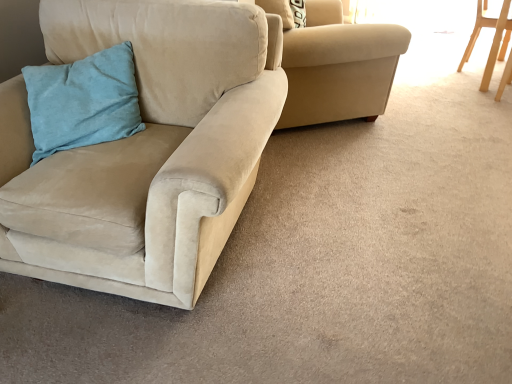
What do you see at coordinates (145, 149) in the screenshot?
I see `suede beige couch at left, which appears as the 3th chair when viewed from the right` at bounding box center [145, 149].

The height and width of the screenshot is (384, 512). Describe the element at coordinates (83, 101) in the screenshot. I see `teal suede pillow at left` at that location.

You are a GUI agent. You are given a task and a screenshot of the screen. Output one action in this format:
    pyautogui.click(x=<x>, y=<y>)
    Task: Click on the light wood chair at upper right, which appears as the first chair when viewed from the right
    The image size is (512, 384).
    Given the screenshot: What is the action you would take?
    pyautogui.click(x=494, y=37)

Which of these two, suede beige armchair at upper center, the 2th chair when ordered from right to left, or light wood chair at upper right, which appears as the first chair when viewed from the right, stands taller?

suede beige armchair at upper center, the 2th chair when ordered from right to left, is taller.

From the picture: Between suede beige armchair at upper center, placed as the 2th chair when sorted from left to right, and light wood chair at upper right, which appears as the 3th chair when viewed from the left, which one has smaller size?

With smaller size is light wood chair at upper right, which appears as the 3th chair when viewed from the left.

At what (x,y) coordinates should I click in order to perform the action: click on chair that appears above the suede beige armchair at upper center, the 2th chair when ordered from right to left (from the image's perspective). Please return your answer as a coordinate pair (x, y). Image resolution: width=512 pixels, height=384 pixels. Looking at the image, I should click on 494,37.

Which point is more forward, [214,211] or [53,127]?

Positioned in front is point [214,211].

Is suede beige couch at left, the 1th chair viewed from the left, aimed at teal suede pillow at left?

Yes, suede beige couch at left, the 1th chair viewed from the left, faces towards teal suede pillow at left.

Is there a large distance between suede beige couch at left, which appears as the 3th chair when viewed from the right, and teal suede pillow at left?

They are positioned close to each other.

Can you confirm if suede beige couch at left, the 1th chair viewed from the left, is positioned to the right of teal suede pillow at left?

Indeed, suede beige couch at left, the 1th chair viewed from the left, is positioned on the right side of teal suede pillow at left.

Does suede beige armchair at upper center, placed as the 2th chair when sorted from left to right, have a larger size compared to teal suede pillow at left?

Yes.

Which object is thinner, suede beige armchair at upper center, the 2th chair when ordered from right to left, or teal suede pillow at left?

With smaller width is teal suede pillow at left.

Is suede beige armchair at upper center, the 2th chair when ordered from right to left, surrounded by suede beige couch at left, which appears as the 3th chair when viewed from the right?

No, suede beige armchair at upper center, the 2th chair when ordered from right to left, is not a part of suede beige couch at left, which appears as the 3th chair when viewed from the right.

Looking at this image, from a real-world perspective, is suede beige couch at left, which appears as the 3th chair when viewed from the right, above or below suede beige armchair at upper center, the 2th chair when ordered from right to left?

In terms of real-world spatial position, suede beige couch at left, which appears as the 3th chair when viewed from the right, is above suede beige armchair at upper center, the 2th chair when ordered from right to left.

Consider the image. Does light wood chair at upper right, which appears as the 3th chair when viewed from the left, have a smaller size compared to suede beige couch at left, the 1th chair viewed from the left?

Correct, light wood chair at upper right, which appears as the 3th chair when viewed from the left, occupies less space than suede beige couch at left, the 1th chair viewed from the left.

Does light wood chair at upper right, which appears as the first chair when viewed from the right, turn towards suede beige couch at left, which appears as the 3th chair when viewed from the right?

No.

Is light wood chair at upper right, which appears as the first chair when viewed from the right, not inside suede beige couch at left, which appears as the 3th chair when viewed from the right?

Yes.

From the image's perspective, is light wood chair at upper right, which appears as the first chair when viewed from the right, positioned above or below suede beige couch at left, the 1th chair viewed from the left?

light wood chair at upper right, which appears as the first chair when viewed from the right, is situated higher than suede beige couch at left, the 1th chair viewed from the left, in the image.

Is suede beige couch at left, the 1th chair viewed from the left, aimed at light wood chair at upper right, which appears as the 3th chair when viewed from the left?

No, suede beige couch at left, the 1th chair viewed from the left, does not turn towards light wood chair at upper right, which appears as the 3th chair when viewed from the left.

Is suede beige couch at left, which appears as the 3th chair when viewed from the right, in front of or behind light wood chair at upper right, which appears as the first chair when viewed from the right, in the image?

suede beige couch at left, which appears as the 3th chair when viewed from the right, is in front of light wood chair at upper right, which appears as the first chair when viewed from the right.

Is point (181, 116) farther from camera compared to point (497, 19)?

That is False.

From a real-world perspective, does suede beige couch at left, which appears as the 3th chair when viewed from the right, stand above light wood chair at upper right, which appears as the first chair when viewed from the right?

Correct, in the physical world, suede beige couch at left, which appears as the 3th chair when viewed from the right, is higher than light wood chair at upper right, which appears as the first chair when viewed from the right.

Is teal suede pillow at left next to light wood chair at upper right, which appears as the 3th chair when viewed from the left?

No, teal suede pillow at left is not in contact with light wood chair at upper right, which appears as the 3th chair when viewed from the left.

From a real-world perspective, is teal suede pillow at left positioned above or below light wood chair at upper right, which appears as the first chair when viewed from the right?

teal suede pillow at left is situated higher than light wood chair at upper right, which appears as the first chair when viewed from the right, in the real world.

Is teal suede pillow at left positioned before light wood chair at upper right, which appears as the first chair when viewed from the right?

Yes, teal suede pillow at left is closer to the viewer.

Could you tell me if teal suede pillow at left is turned towards light wood chair at upper right, which appears as the first chair when viewed from the right?

No, teal suede pillow at left is not facing towards light wood chair at upper right, which appears as the first chair when viewed from the right.

Find the location of a particular element. The width and height of the screenshot is (512, 384). chair on the right of suede beige armchair at upper center, placed as the 2th chair when sorted from left to right is located at coordinates (494, 37).

Locate an element on the screen. pillow that is behind the suede beige couch at left, which appears as the 3th chair when viewed from the right is located at coordinates (83, 101).

Based on their spatial positions, is suede beige couch at left, the 1th chair viewed from the left, or teal suede pillow at left closer to suede beige armchair at upper center, placed as the 2th chair when sorted from left to right?

Among the two, suede beige couch at left, the 1th chair viewed from the left, is located nearer to suede beige armchair at upper center, placed as the 2th chair when sorted from left to right.

When comparing their distances from light wood chair at upper right, which appears as the 3th chair when viewed from the left, does suede beige armchair at upper center, the 2th chair when ordered from right to left, or suede beige couch at left, which appears as the 3th chair when viewed from the right, seem closer?

suede beige armchair at upper center, the 2th chair when ordered from right to left, is positioned closer to the anchor light wood chair at upper right, which appears as the 3th chair when viewed from the left.

Looking at the image, which one is located closer to suede beige couch at left, the 1th chair viewed from the left, suede beige armchair at upper center, placed as the 2th chair when sorted from left to right, or teal suede pillow at left?

Among the two, teal suede pillow at left is located nearer to suede beige couch at left, the 1th chair viewed from the left.

When comparing their distances from light wood chair at upper right, which appears as the first chair when viewed from the right, does suede beige armchair at upper center, the 2th chair when ordered from right to left, or teal suede pillow at left seem further?

Among the two, teal suede pillow at left is located further to light wood chair at upper right, which appears as the first chair when viewed from the right.

Which object lies nearer to the anchor point light wood chair at upper right, which appears as the first chair when viewed from the right, teal suede pillow at left or suede beige armchair at upper center, placed as the 2th chair when sorted from left to right?

suede beige armchair at upper center, placed as the 2th chair when sorted from left to right, is positioned closer to the anchor light wood chair at upper right, which appears as the first chair when viewed from the right.

When comparing their distances from suede beige couch at left, which appears as the 3th chair when viewed from the right, does light wood chair at upper right, which appears as the 3th chair when viewed from the left, or suede beige armchair at upper center, the 2th chair when ordered from right to left, seem further?

Among the two, light wood chair at upper right, which appears as the 3th chair when viewed from the left, is located further to suede beige couch at left, which appears as the 3th chair when viewed from the right.

When comparing their distances from light wood chair at upper right, which appears as the first chair when viewed from the right, does suede beige couch at left, the 1th chair viewed from the left, or teal suede pillow at left seem further?

teal suede pillow at left lies further to light wood chair at upper right, which appears as the first chair when viewed from the right, than the other object.

When comparing their distances from suede beige armchair at upper center, placed as the 2th chair when sorted from left to right, does teal suede pillow at left or light wood chair at upper right, which appears as the 3th chair when viewed from the left, seem further?

Based on the image, light wood chair at upper right, which appears as the 3th chair when viewed from the left, appears to be further to suede beige armchair at upper center, placed as the 2th chair when sorted from left to right.

Where is `chair located between suede beige couch at left, the 1th chair viewed from the left, and light wood chair at upper right, which appears as the first chair when viewed from the right, in the left-right direction`? chair located between suede beige couch at left, the 1th chair viewed from the left, and light wood chair at upper right, which appears as the first chair when viewed from the right, in the left-right direction is located at coordinates (335, 64).

Identify the location of pillow located between suede beige couch at left, which appears as the 3th chair when viewed from the right, and suede beige armchair at upper center, the 2th chair when ordered from right to left, in the depth direction. The width and height of the screenshot is (512, 384). (83, 101).